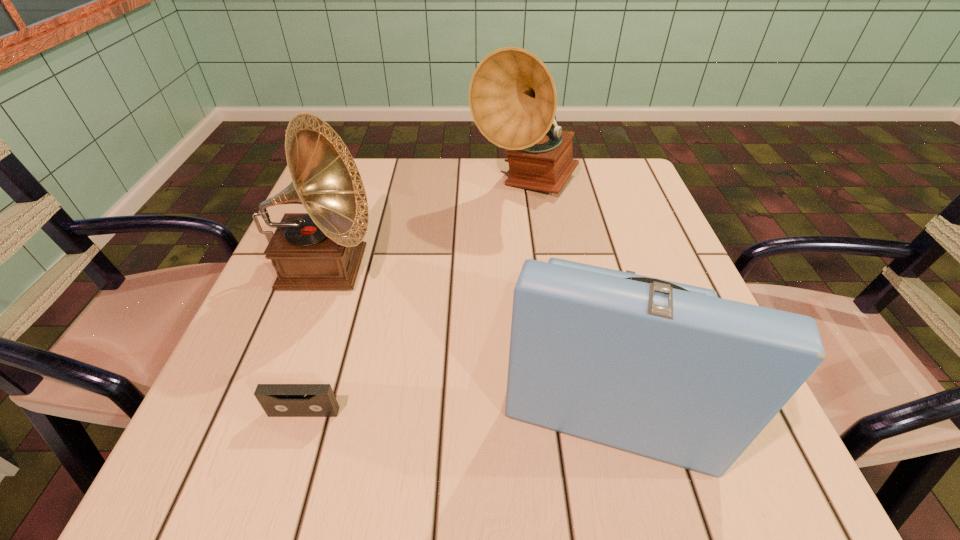
Where is `the farthest phonograph record`? The width and height of the screenshot is (960, 540). the farthest phonograph record is located at coordinates (512, 96).

The width and height of the screenshot is (960, 540). In order to click on the leftmost phonograph record in this screenshot , I will do `click(323, 249)`.

Find the location of a particular element. videotape is located at coordinates (277, 400).

Identify the location of free spot located 0.370m on the horn of the farthest object. The width and height of the screenshot is (960, 540). (547, 342).

Locate an element on the screen. vacant area located 0.360m on the horn of the leftmost phonograph record is located at coordinates (551, 269).

The height and width of the screenshot is (540, 960). In order to click on object that is positioned at the far edge in this screenshot , I will do `click(512, 96)`.

Where is `object that is at the near edge`? This screenshot has width=960, height=540. object that is at the near edge is located at coordinates (668, 371).

Find the location of a particular element. The height and width of the screenshot is (540, 960). phonograph record that is at the left edge is located at coordinates (323, 249).

Identify the location of videotape present at the left edge. The image size is (960, 540). (277, 400).

Find the location of a particular element. This screenshot has height=540, width=960. object present at the far right corner is located at coordinates (512, 96).